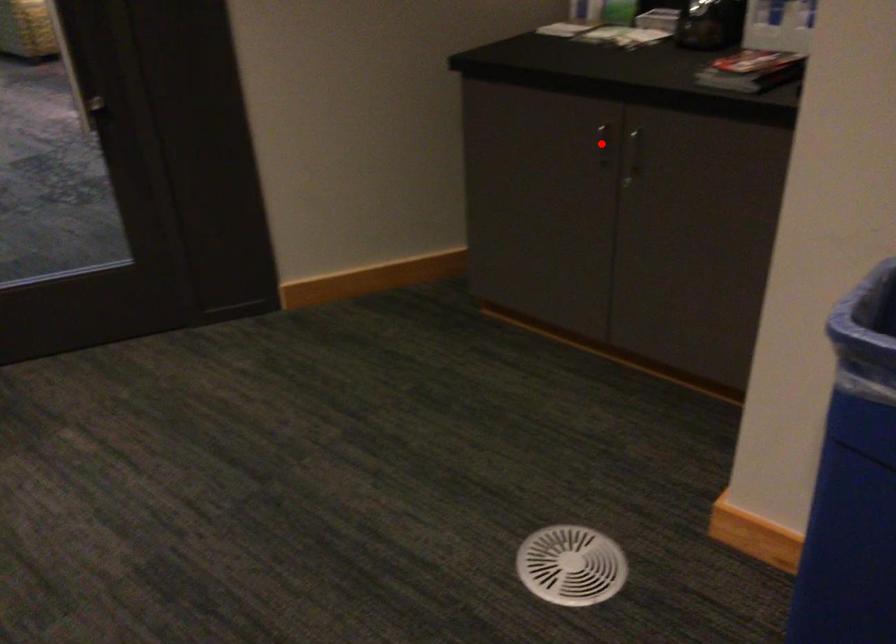
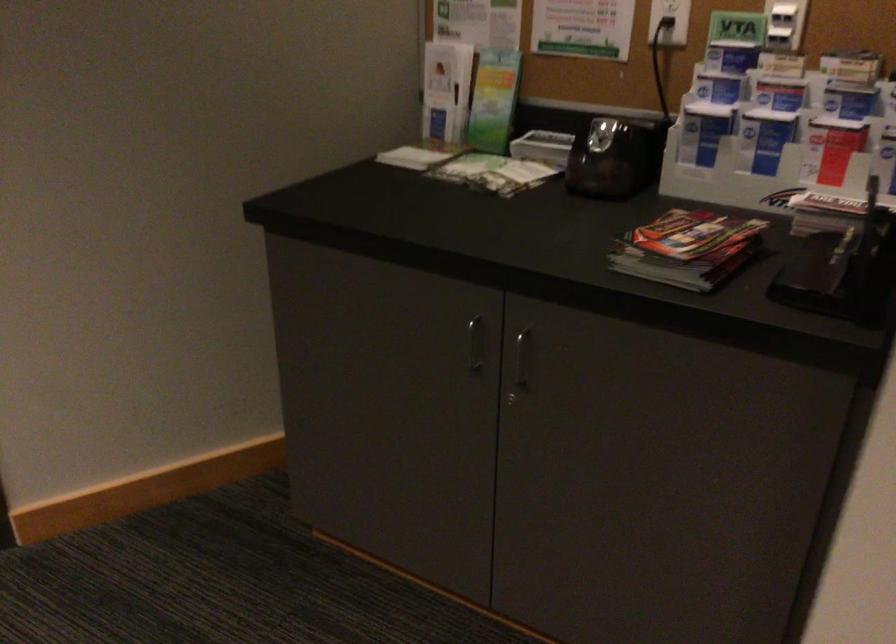
The point at the highlighted location is marked in the first image. Where is the corresponding point in the second image?

(475, 343)